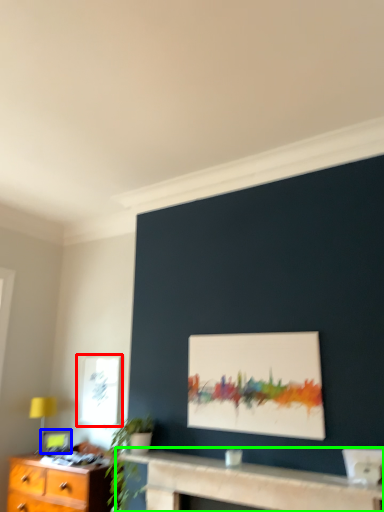
Question: Considering the real-world distances, which object is farthest from window (highlighted by a red box)? picture frame (highlighted by a blue box) or table (highlighted by a green box)?

Choices:
 (A) picture frame
 (B) table

Answer: (B)